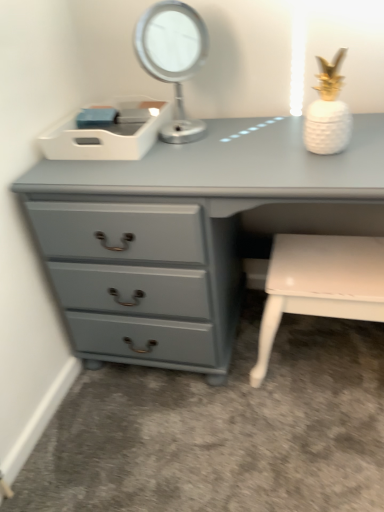
This screenshot has height=512, width=384. Identify the location of vacant area on top of white glossy bench at lower right (from a real-world perspective). (320, 271).